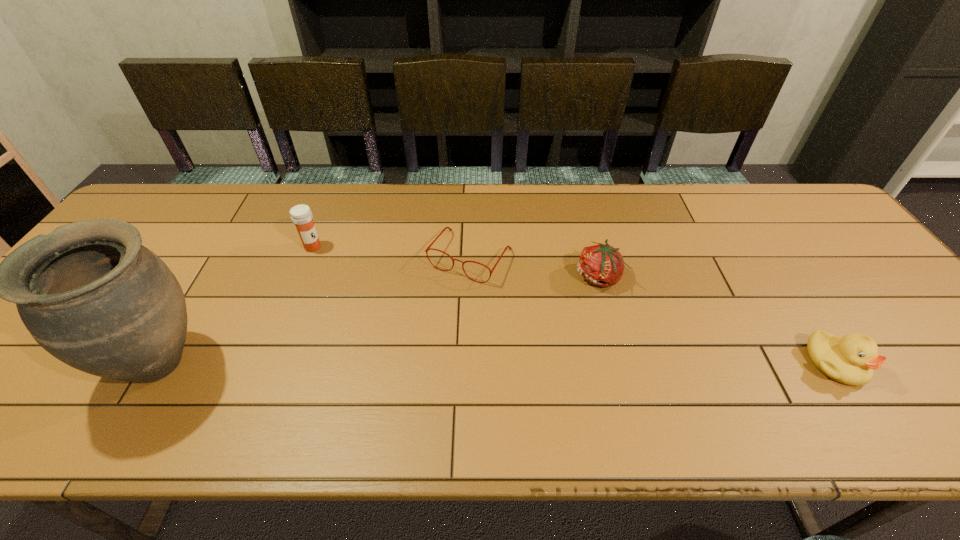
Image resolution: width=960 pixels, height=540 pixels. Find the location of `free space located on the label side of the fourth shortest object`. free space located on the label side of the fourth shortest object is located at coordinates (419, 319).

This screenshot has width=960, height=540. Find the location of `blank area located 0.240m on the label side of the fourth shortest object`. blank area located 0.240m on the label side of the fourth shortest object is located at coordinates (376, 290).

I want to click on vacant space located on the front-facing side of the tomato, so click(559, 301).

Identify the location of free region located 0.280m on the front-facing side of the tomato. (496, 339).

At what (x,y) coordinates should I click in order to perform the action: click on vacant space located on the front-facing side of the tomato. Please return your answer as a coordinate pair (x, y). Looking at the image, I should click on (466, 359).

Find the location of `free space located 0.310m on the face of the third object from left to right`. free space located 0.310m on the face of the third object from left to right is located at coordinates (388, 380).

Where is `free space located 0.080m on the face of the third object from left to right`? free space located 0.080m on the face of the third object from left to right is located at coordinates (437, 306).

Where is `free region located on the face of the third object from left to right`? free region located on the face of the third object from left to right is located at coordinates tap(441, 300).

At what (x,y) coordinates should I click in order to perform the action: click on object situated at the far edge. Please return your answer as a coordinate pair (x, y). Looking at the image, I should click on (428, 248).

I want to click on urn located at the near edge, so click(89, 293).